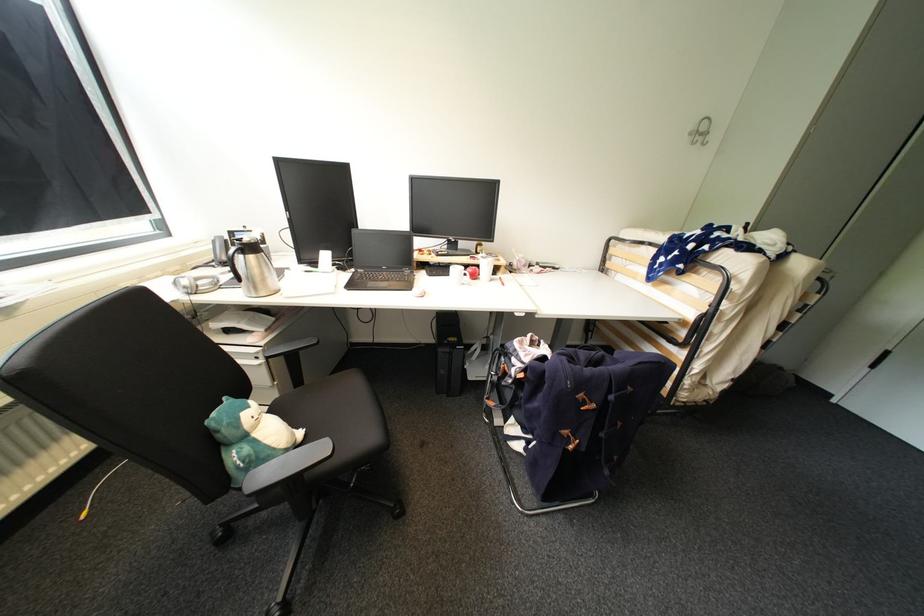
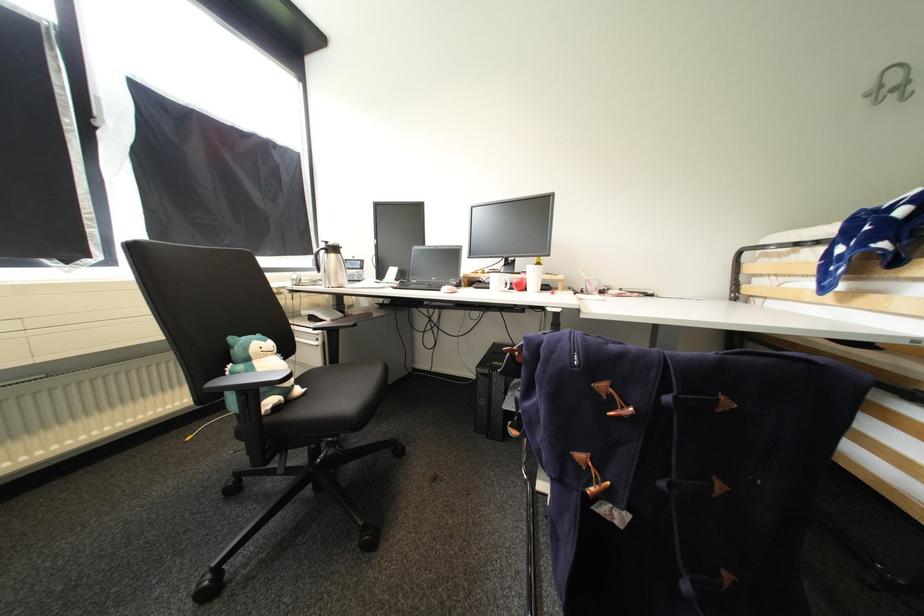
In the second image, find the point that corresponds to pixel 572 432 in the first image.

(588, 458)